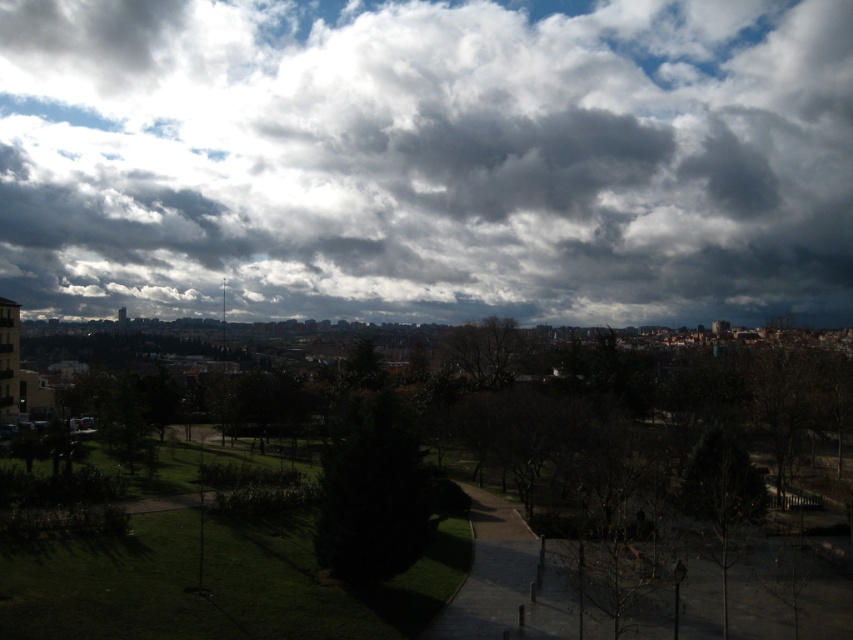
Question: Is cloudy sky at upper center below bare branches at lower right?

Choices:
 (A) yes
 (B) no

Answer: (B)

Question: Which point is closer to the camera?

Choices:
 (A) (747, 496)
 (B) (343, 84)
 (C) (608, 477)

Answer: (C)

Question: Considering the real-world distances, which object is farthest from the cloudy sky at upper center?

Choices:
 (A) green leafy tree at center
 (B) bare branches at lower right

Answer: (B)

Question: Does cloudy sky at upper center appear over green leafy tree at center?

Choices:
 (A) no
 (B) yes

Answer: (B)

Question: Does cloudy sky at upper center have a smaller size compared to bare branches at lower right?

Choices:
 (A) no
 (B) yes

Answer: (A)

Question: Which point is farther from the camera taking this photo?

Choices:
 (A) (6, 477)
 (B) (267, 305)

Answer: (B)